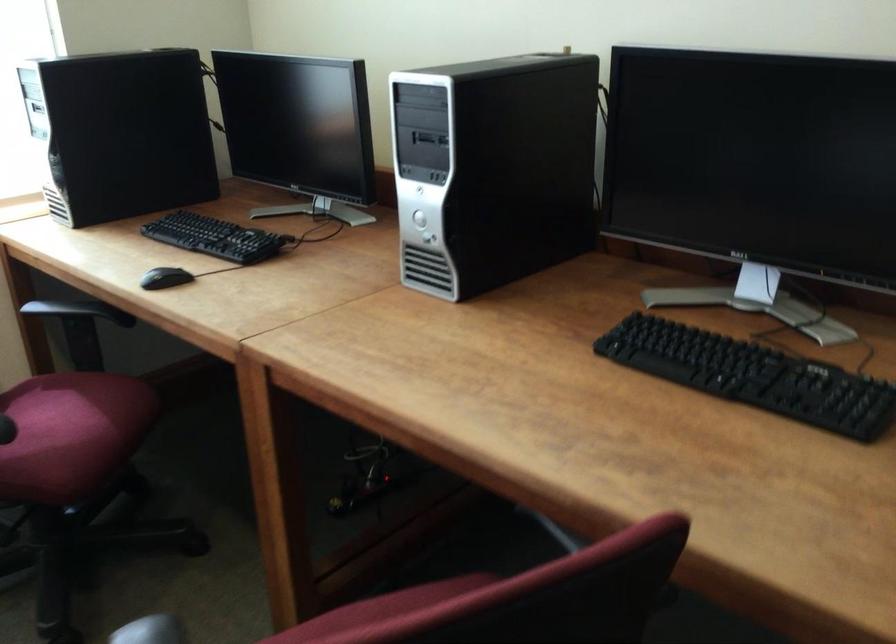
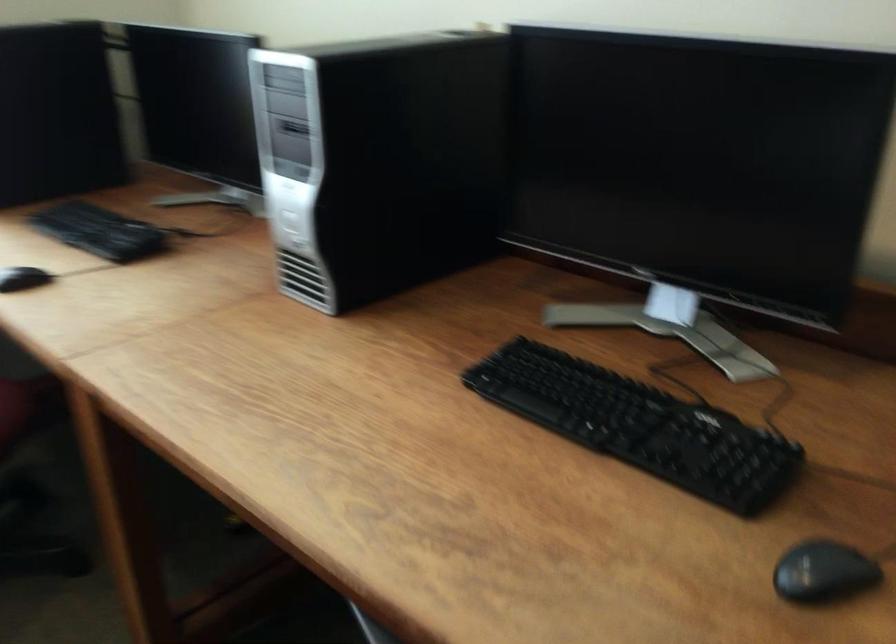
Question: How did the camera likely rotate?

Choices:
 (A) Left
 (B) Right
 (C) Up
 (D) Down

Answer: (D)